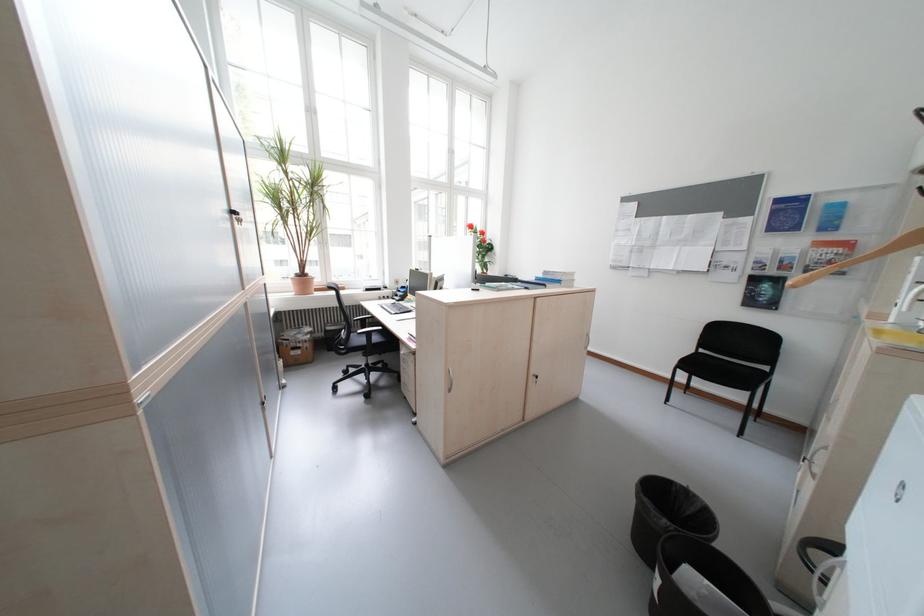
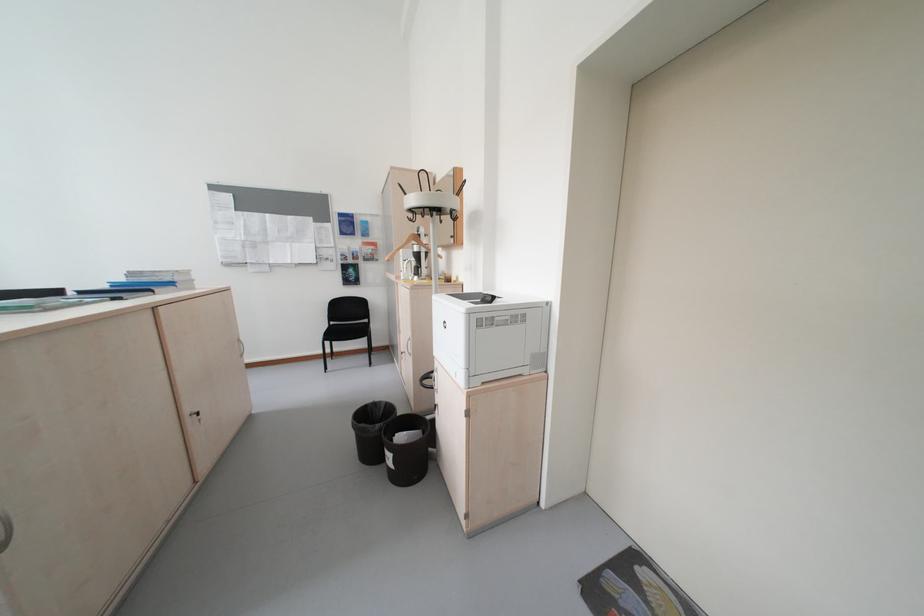
In the second image, find the point that corresponds to point 675,523 in the first image.

(388, 427)